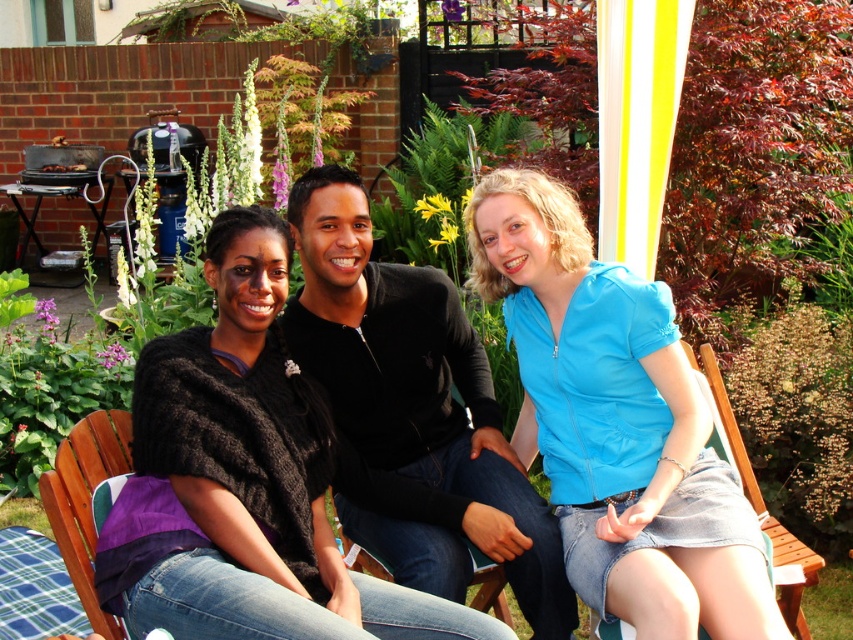
Question: Which point is farther from the camera taking this photo?

Choices:
 (A) (807, 560)
 (B) (96, 595)
 (C) (335, 292)

Answer: (A)

Question: Which object is positioned closest to the knitted black shawl at center?

Choices:
 (A) purple fabric chair at lower left
 (B) black matte sweater at center

Answer: (A)

Question: Can you confirm if knitted black shawl at center is smaller than purple fabric chair at lower left?

Choices:
 (A) no
 (B) yes

Answer: (A)

Question: Among these objects, which one is nearest to the camera?

Choices:
 (A) blue zip-up hoodie at center
 (B) black matte sweater at center
 (C) purple fabric chair at lower left
 (D) knitted black shawl at center

Answer: (D)

Question: Is blue zip-up hoodie at center behind black matte sweater at center?

Choices:
 (A) yes
 (B) no

Answer: (B)

Question: Can you confirm if black matte sweater at center is thinner than purple fabric chair at lower left?

Choices:
 (A) yes
 (B) no

Answer: (B)